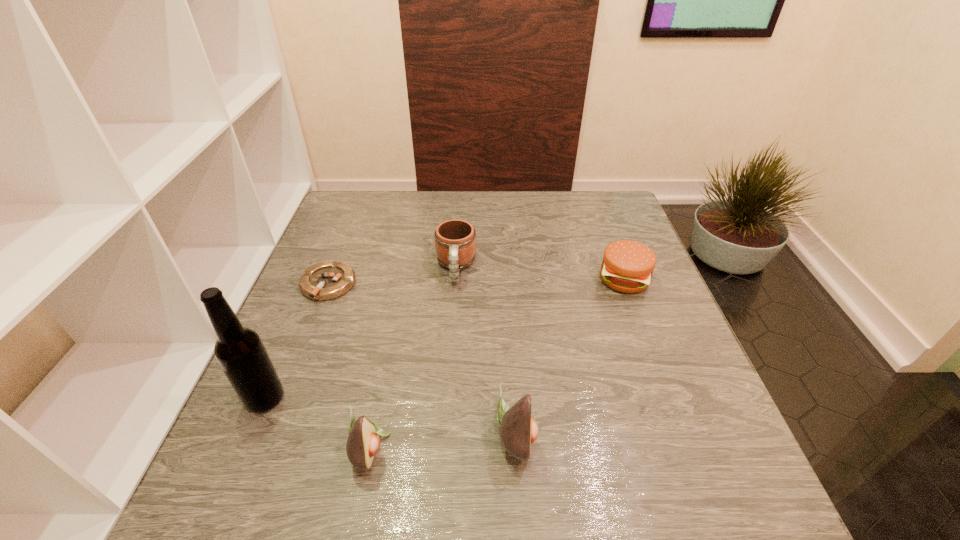
Find the location of a particular element. The width and height of the screenshot is (960, 540). vacant space situated 0.210m on the side of the third object from right to left with the handle is located at coordinates (450, 355).

The height and width of the screenshot is (540, 960). Find the location of `vacant space situated 0.140m on the back of the hamburger`. vacant space situated 0.140m on the back of the hamburger is located at coordinates (606, 232).

Locate an element on the screen. blank area located 0.110m on the back of the shortest object is located at coordinates (345, 241).

Where is `free space located on the back of the beer bottle`? free space located on the back of the beer bottle is located at coordinates (288, 344).

You are a GUI agent. You are given a task and a screenshot of the screen. Output one action in this format:
    pyautogui.click(x=<x>, y=<y>)
    Task: Click on the beer bottle that is at the near edge
    
    Given the screenshot: What is the action you would take?
    pyautogui.click(x=240, y=352)

Locate an element on the screen. ashtray present at the left edge is located at coordinates (327, 280).

What are the coordinates of `beer bottle that is at the left edge` in the screenshot? It's located at (240, 352).

This screenshot has height=540, width=960. In order to click on object present at the right edge in this screenshot , I will do `click(627, 266)`.

This screenshot has width=960, height=540. What are the coordinates of `object that is at the near left corner` in the screenshot? It's located at (240, 352).

You are a GUI agent. You are given a task and a screenshot of the screen. Output one action in this format:
    pyautogui.click(x=<x>, y=<y>)
    Task: Click on the vacant space at the far edge of the desktop
    
    Given the screenshot: What is the action you would take?
    pyautogui.click(x=430, y=195)